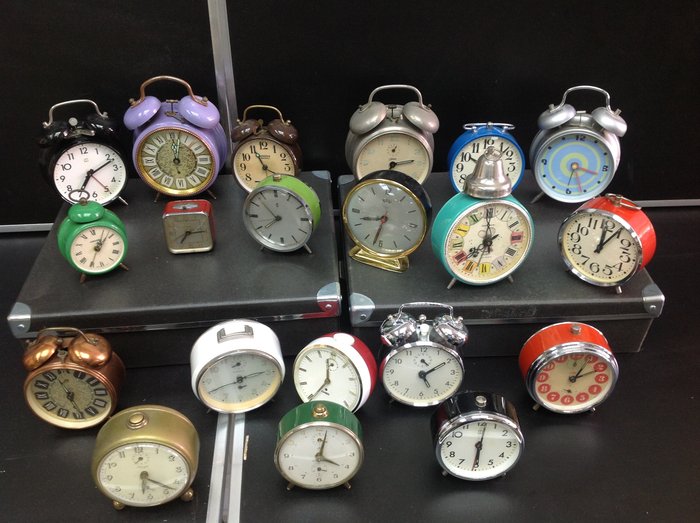
The image size is (700, 523). Identify the location of red clock. (195, 211), (628, 210), (360, 344).